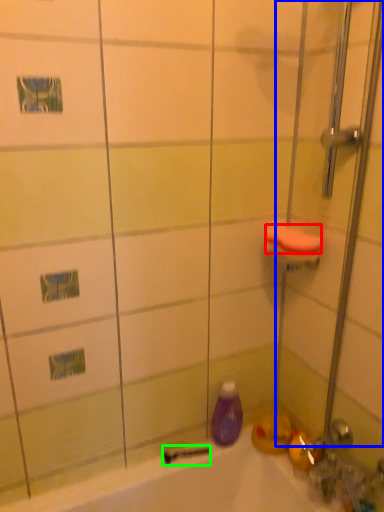
Question: Which is farther away from soap (highlighted by a red box)? shower door (highlighted by a blue box) or shower (highlighted by a green box)?

Choices:
 (A) shower door
 (B) shower

Answer: (B)